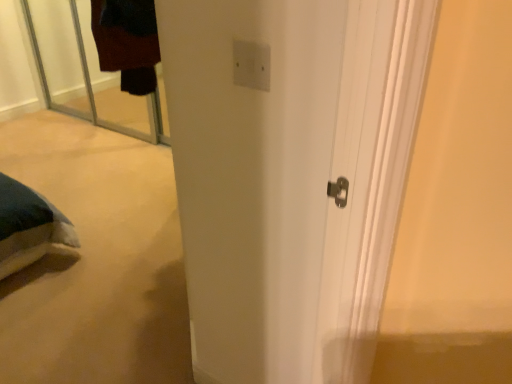
The height and width of the screenshot is (384, 512). Describe the element at coordinates (251, 65) in the screenshot. I see `white plastic light switch at upper center` at that location.

What is the approximate height of white plastic light switch at upper center?

It is 8.89 centimeters.

This screenshot has width=512, height=384. Find the location of `white plastic light switch at upper center`. white plastic light switch at upper center is located at coordinates (251, 65).

Locate an element on the screen. white plastic light switch at upper center is located at coordinates (251, 65).